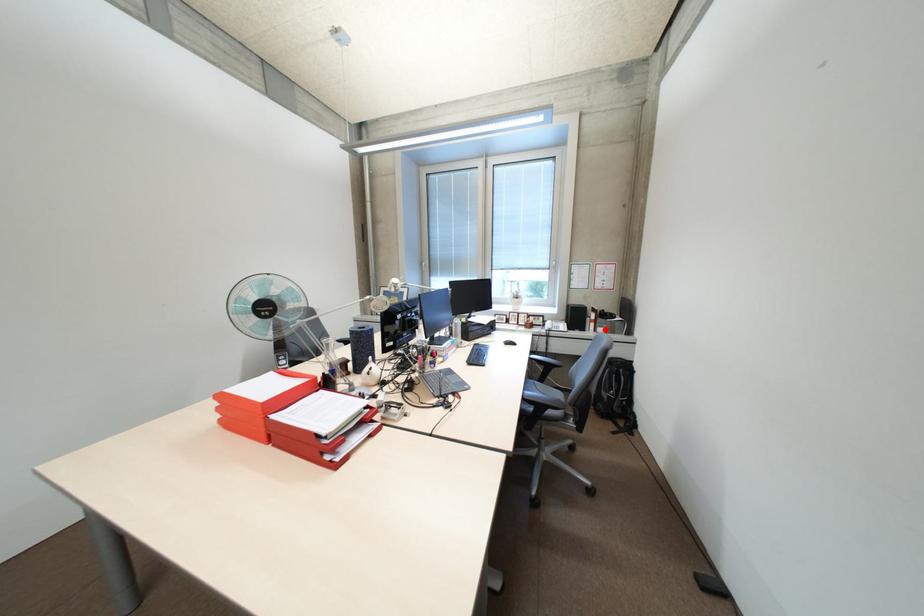
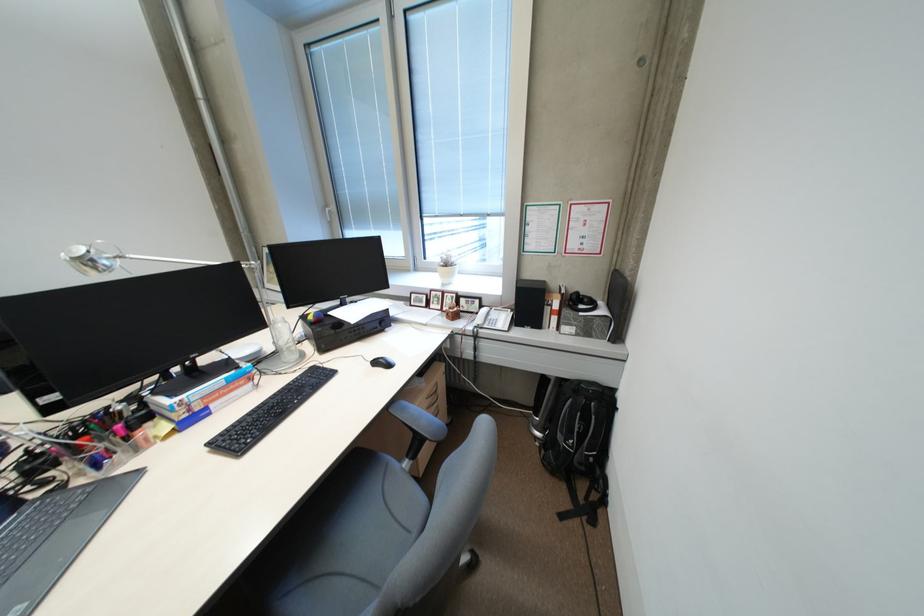
In the second image, find the point that corresponds to the highlighted location in the first image.

(568, 328)